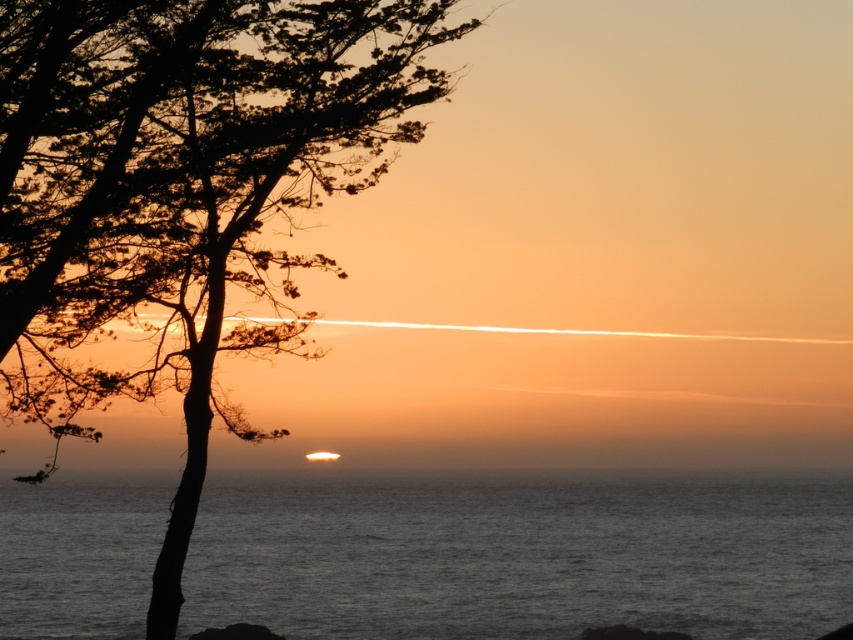
You are a photographer planning to take a photo of the dark gray water at center and the silhouette bark tree at left. The camera you are using has a minimum focusing distance of 250 feet. Will you need to adjust your position to ensure both subjects are in focus?

The silhouette bark tree at left is 261.96 feet away from the dark gray water at center. Since the minimum focusing distance is 250 feet, you need to move closer to ensure both subjects are within the camera range.

You are a photographer planning to capture the sunset scene. You want to ensure that the silhouette bark tree at left and the dark gray water at center are both visible in your shot. Based on their widths, which object should you prioritize framing closer to the edge of the photo?

The silhouette bark tree at left has a lesser width compared to dark gray water at center, so you should prioritize framing the silhouette bark tree at left closer to the edge of the photo to accommodate its narrower size.

You are standing at the point labeled point [19,396] and want to walk towards the point labeled point [695,502]. Given that both points are on the same path, which direction should you face to move towards your destination?

Since point [19,396] is closer to the viewer than point [695,502], you should face away from the viewer to move towards your destination.